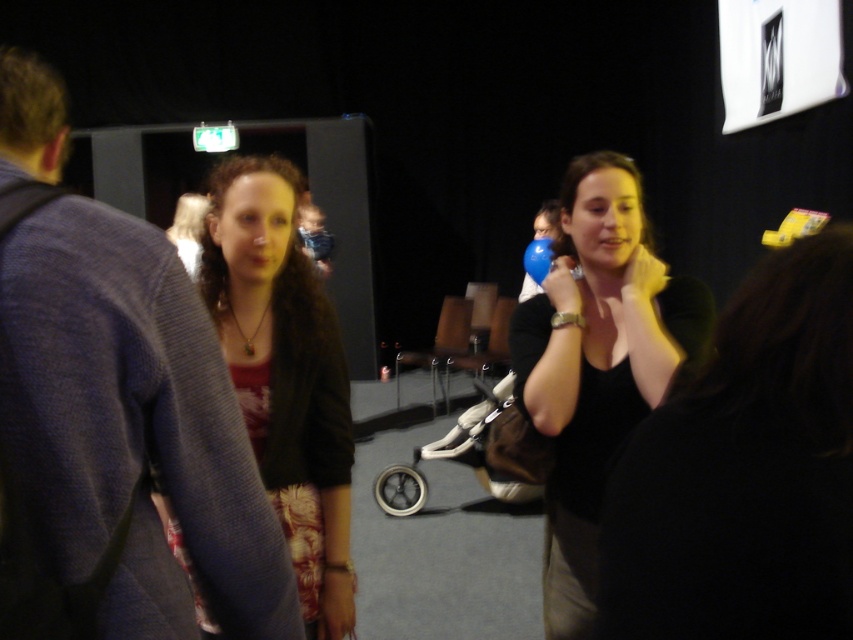
In the scene shown: You are standing 5 feet away from the camera. Can you see the matte black shirt at center from your current position?

The matte black shirt at center is 3.57 feet away from the camera. Since you are 5 feet away from the camera, you are farther than the shirt, so you might not be able to see it clearly or at all depending on the camera angle and field of view.

You are at a social event and want to find the person wearing the dark blue sweater at left. Since you are standing near the matte black jacket at center, which direction should you look to locate them?

The dark blue sweater at left has a lesser height compared to matte black jacket at center, so you should look to your left and downward to locate them.